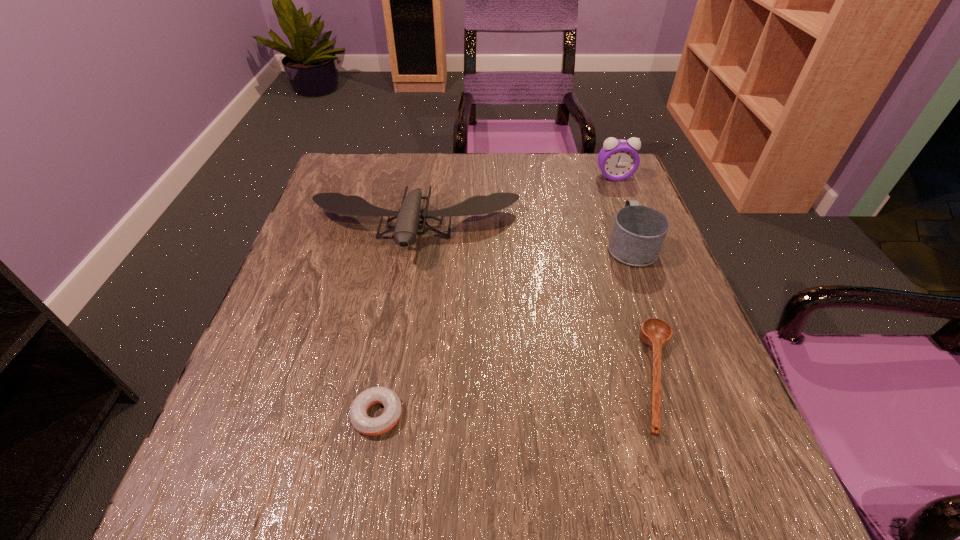
Locate an element on the screen. The height and width of the screenshot is (540, 960). vacant area between the wooden spoon and the alarm clock is located at coordinates (636, 278).

You are a GUI agent. You are given a task and a screenshot of the screen. Output one action in this format:
    pyautogui.click(x=<x>, y=<y>)
    Task: Click on the vacant area between the doughnut and the drone
    Image resolution: width=960 pixels, height=540 pixels.
    Given the screenshot: What is the action you would take?
    pyautogui.click(x=396, y=322)

Find the location of a particular element. free space between the doughnut and the mug is located at coordinates (504, 330).

You are a GUI agent. You are given a task and a screenshot of the screen. Output one action in this format:
    pyautogui.click(x=<x>, y=<y>)
    Task: Click on the unoccupied position between the doughnut and the wooden spoon
    Image resolution: width=960 pixels, height=540 pixels.
    Given the screenshot: What is the action you would take?
    pyautogui.click(x=516, y=397)

You are a GUI agent. You are given a task and a screenshot of the screen. Output one action in this format:
    pyautogui.click(x=<x>, y=<y>)
    Task: Click on the unoccupied position between the drone and the tallest object
    The height and width of the screenshot is (540, 960).
    Given the screenshot: What is the action you would take?
    pyautogui.click(x=515, y=203)

Find the location of a particular element. vacant space that is in between the wooden spoon and the mug is located at coordinates (643, 312).

You are a GUI agent. You are given a task and a screenshot of the screen. Output one action in this format:
    pyautogui.click(x=<x>, y=<y>)
    Task: Click on the free space between the wooden spoon and the doughnut
    The image size is (960, 540).
    Given the screenshot: What is the action you would take?
    pyautogui.click(x=516, y=397)

Find the location of a particular element. object that is the second closest to the wooden spoon is located at coordinates (405, 230).

Point out which object is positioned as the third nearest to the wooden spoon. Please provide its 2D coordinates. Your answer should be formatted as a tuple, i.e. [(x, y)], where the tuple contains the x and y coordinates of a point satisfying the conditions above.

[(361, 422)]

You are a GUI agent. You are given a task and a screenshot of the screen. Output one action in this format:
    pyautogui.click(x=<x>, y=<y>)
    Task: Click on the vacant area that satisfies the following two spatial constraints: 1. at the head of the drone; 2. on the left side of the wooden spoon
    
    Given the screenshot: What is the action you would take?
    pyautogui.click(x=390, y=379)